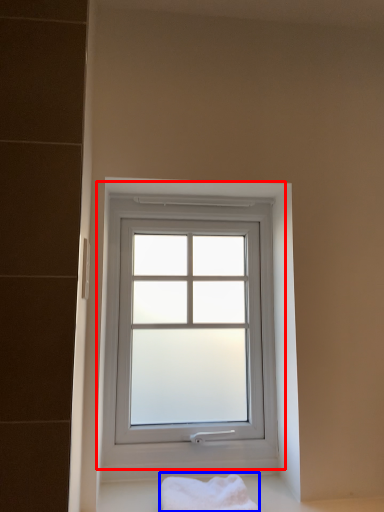
Question: Which object appears closest to the camera in this image, window (highlighted by a red box) or bath towel (highlighted by a blue box)?

Choices:
 (A) window
 (B) bath towel

Answer: (B)